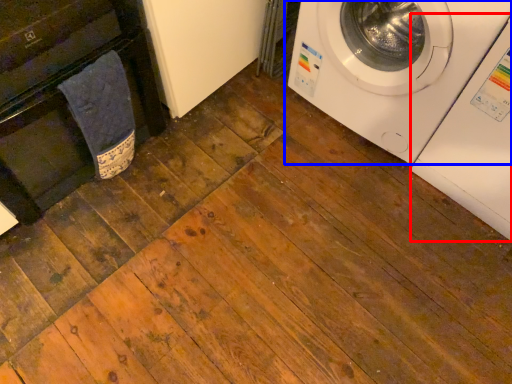
Question: Which object is further to the camera taking this photo, washing machine (highlighted by a red box) or washing machine (highlighted by a blue box)?

Choices:
 (A) washing machine
 (B) washing machine

Answer: (B)